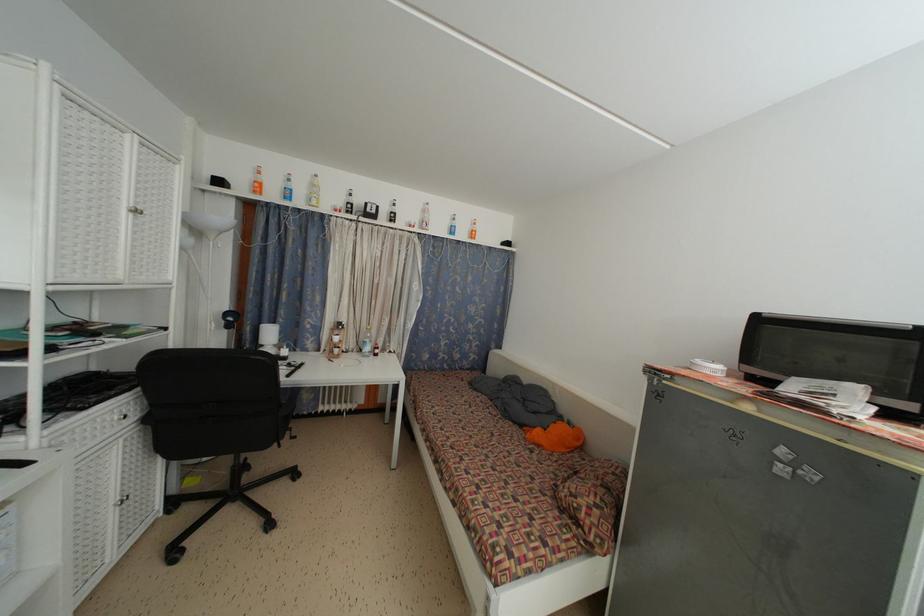
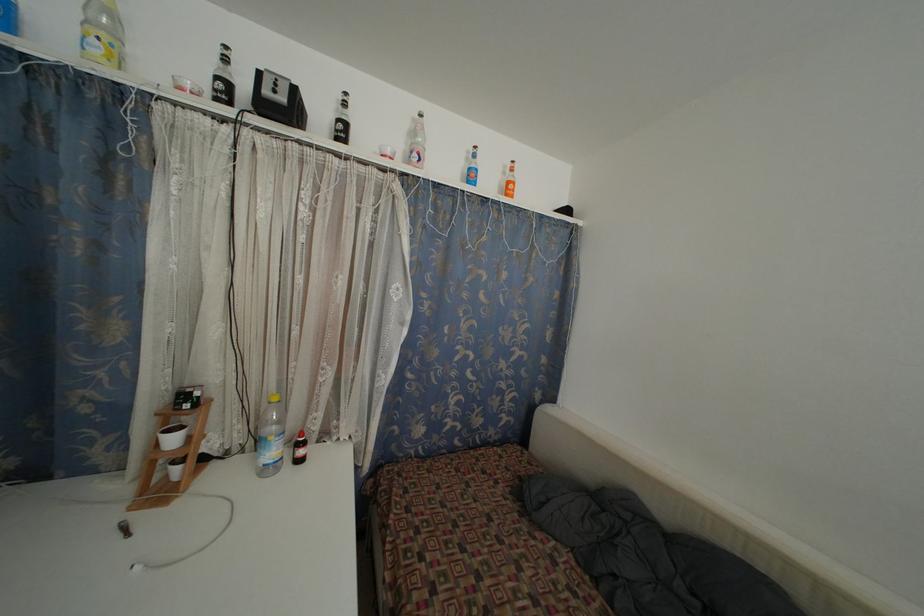
In the second image, find the point that corresponds to point 381,357 in the first image.

(305, 458)